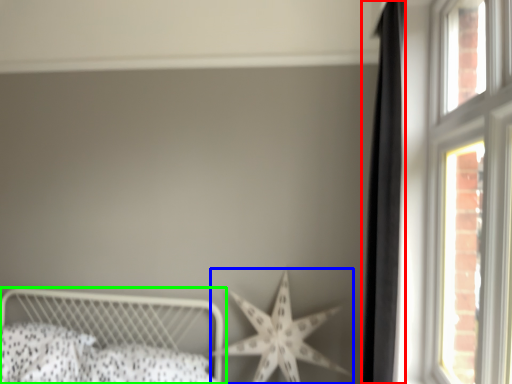
Question: Which object is the closest to the curtain (highlighted by a red box)? Choose among these: starfish (highlighted by a blue box) or bed (highlighted by a green box).

Choices:
 (A) starfish
 (B) bed

Answer: (A)